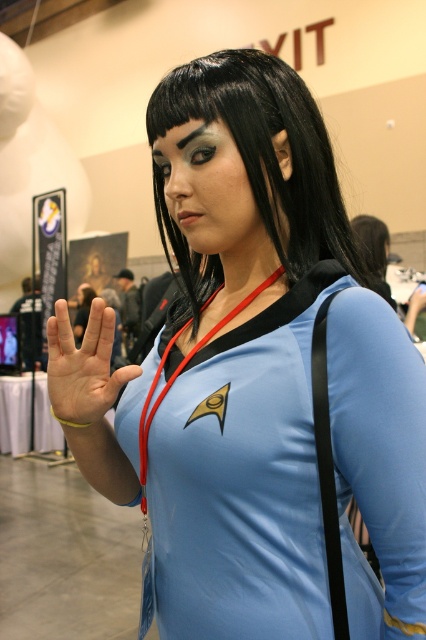
You are a photographer at a convention. You see a person in a Starfleet uniform with their black smooth hair at center and light skin palm at center. Which object is higher up on their body?

The black smooth hair at center is taller than the light skin palm at center, so the black smooth hair at center is higher up on their body.

You are a photographer at a convention. You want to capture a closeup shot of the light skin palm at center and black smooth hair at center. What is the minimum distance you should set your camera lens to focus on to ensure both are in focus?

The black smooth hair at center and light skin palm at center are 9.80 inches apart, so the minimum focusing distance should be at least 9.80 inches to ensure both are in focus.